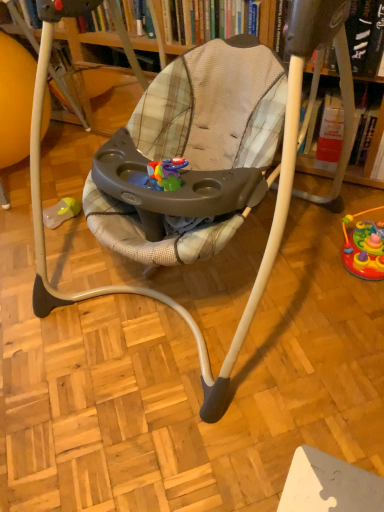
Question: Does hardcover book at upper center, the 2th book positioned from the left, come in front of hardcover book at upper center, which is the 1th book from left to right?

Choices:
 (A) yes
 (B) no

Answer: (A)

Question: Is hardcover book at upper center, the first book viewed from the right, bigger than hardcover book at upper center, which is the 1th book from left to right?

Choices:
 (A) no
 (B) yes

Answer: (B)

Question: Does hardcover book at upper center, the 2th book positioned from the left, have a lesser width compared to hardcover book at upper center, which is the 1th book from left to right?

Choices:
 (A) yes
 (B) no

Answer: (B)

Question: Is hardcover book at upper center, the first book viewed from the right, to the left of hardcover book at upper center, the 2th book from the right, from the viewer's perspective?

Choices:
 (A) yes
 (B) no

Answer: (B)

Question: From the image's perspective, does hardcover book at upper center, the 2th book positioned from the left, appear higher than hardcover book at upper center, the 2th book from the right?

Choices:
 (A) no
 (B) yes

Answer: (A)

Question: Can you confirm if hardcover book at upper center, the 2th book positioned from the left, is shorter than hardcover book at upper center, which is the 1th book from left to right?

Choices:
 (A) yes
 (B) no

Answer: (B)

Question: Is there a large distance between plaid fabric baby swing at center and rubberized plastic toy at lower right?

Choices:
 (A) no
 (B) yes

Answer: (A)

Question: Considering the relative positions of plaid fabric baby swing at center and rubberized plastic toy at lower right in the image provided, is plaid fabric baby swing at center to the left of rubberized plastic toy at lower right from the viewer's perspective?

Choices:
 (A) yes
 (B) no

Answer: (A)

Question: Is plaid fabric baby swing at center closer to camera compared to rubberized plastic toy at lower right?

Choices:
 (A) no
 (B) yes

Answer: (B)

Question: Is plaid fabric baby swing at center bigger than rubberized plastic toy at lower right?

Choices:
 (A) yes
 (B) no

Answer: (A)

Question: Can you confirm if plaid fabric baby swing at center is shorter than rubberized plastic toy at lower right?

Choices:
 (A) no
 (B) yes

Answer: (A)

Question: Is plaid fabric baby swing at center completely or partially outside of rubberized plastic toy at lower right?

Choices:
 (A) no
 (B) yes

Answer: (B)

Question: Is hardcover book at upper center, the 2th book from the right, smaller than hardcover book at upper center, the first book viewed from the right?

Choices:
 (A) no
 (B) yes

Answer: (B)